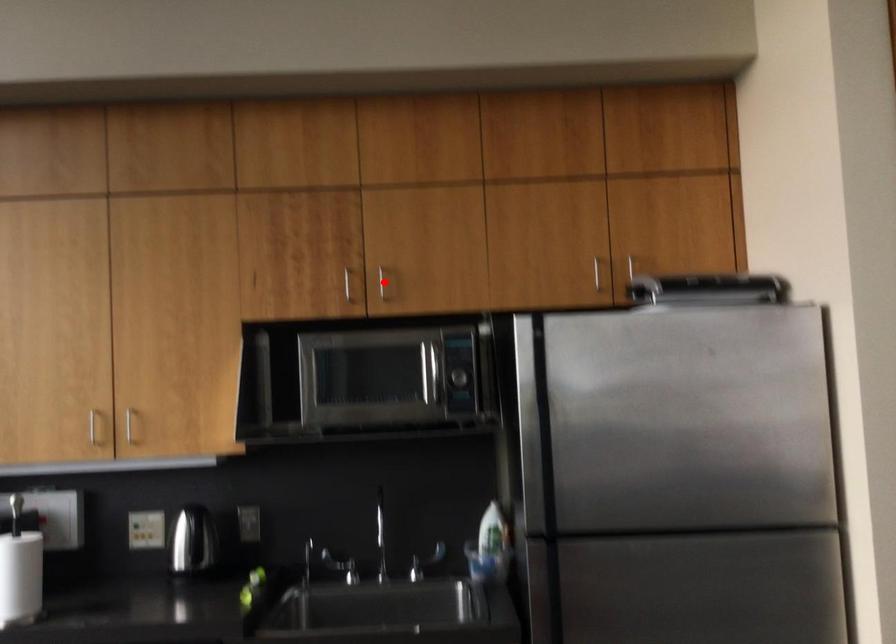
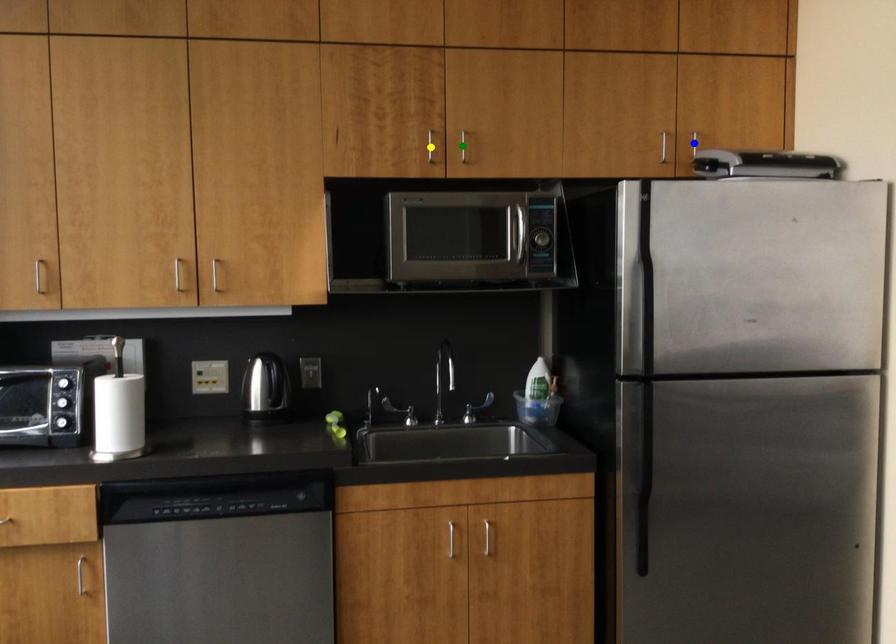
Question: I am providing you with two images of the same scene from different viewpoints. A red point is marked on the first image. You are given multiple points on the second image. Which point in image 2 is actually the same real-world point as the red point in image 1?

Choices:
 (A) blue point
 (B) green point
 (C) yellow point

Answer: (B)